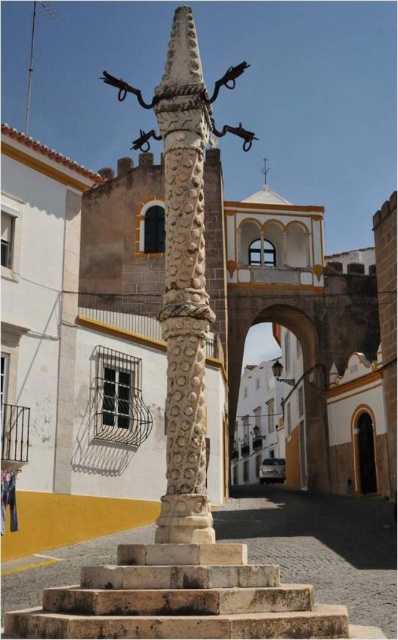
Question: Does white carved stone totem pole at center appear on the left side of stone stairs at center?

Choices:
 (A) yes
 (B) no

Answer: (A)

Question: Can you confirm if white carved stone totem pole at center is positioned to the right of stone stairs at center?

Choices:
 (A) yes
 (B) no

Answer: (B)

Question: Can you confirm if white carved stone totem pole at center is smaller than stone stairs at center?

Choices:
 (A) yes
 (B) no

Answer: (B)